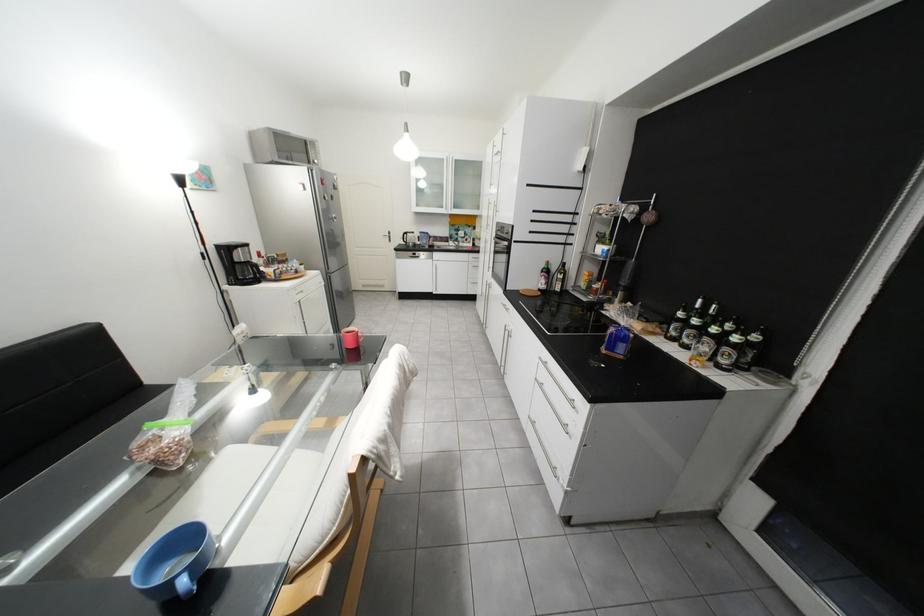
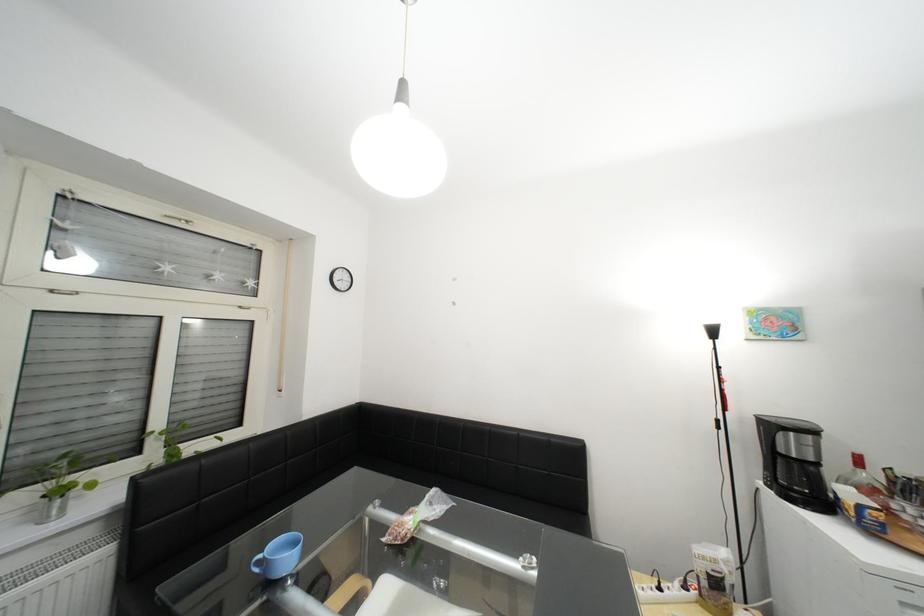
Locate, in the second image, the point that corresponds to (288,281) in the first image.

(886, 533)